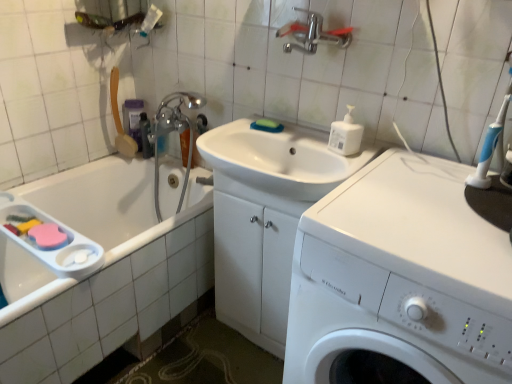
Question: Is green sponge at sink completely or partially inside blue plastic toothbrush at upper right?

Choices:
 (A) no
 (B) yes

Answer: (A)

Question: Can you confirm if blue plastic toothbrush at upper right is bigger than green sponge at sink?

Choices:
 (A) no
 (B) yes

Answer: (B)

Question: Does blue plastic toothbrush at upper right turn towards green sponge at sink?

Choices:
 (A) no
 (B) yes

Answer: (A)

Question: From a real-world perspective, is blue plastic toothbrush at upper right positioned over green sponge at sink based on gravity?

Choices:
 (A) no
 (B) yes

Answer: (B)

Question: Is the position of blue plastic toothbrush at upper right less distant than that of green sponge at sink?

Choices:
 (A) yes
 (B) no

Answer: (A)

Question: Is blue plastic toothbrush at upper right to the right of green sponge at sink from the viewer's perspective?

Choices:
 (A) no
 (B) yes

Answer: (B)

Question: Could you tell me if translucent plastic shampoo bottle at upper left, the second toiletry when ordered from right to left, is turned towards white glossy sink at center?

Choices:
 (A) no
 (B) yes

Answer: (A)

Question: Is white glossy sink at center at the back of translucent plastic shampoo bottle at upper left, the second toiletry when ordered from right to left?

Choices:
 (A) yes
 (B) no

Answer: (B)

Question: From a real-world perspective, is translucent plastic shampoo bottle at upper left, the first toiletry positioned from the left, below white glossy sink at center?

Choices:
 (A) no
 (B) yes

Answer: (B)

Question: Can you confirm if translucent plastic shampoo bottle at upper left, the second toiletry when ordered from right to left, is wider than white glossy sink at center?

Choices:
 (A) yes
 (B) no

Answer: (B)

Question: Is translucent plastic shampoo bottle at upper left, the first toiletry positioned from the left, smaller than white glossy sink at center?

Choices:
 (A) no
 (B) yes

Answer: (B)

Question: Can you confirm if translucent plastic shampoo bottle at upper left, the second toiletry when ordered from right to left, is positioned to the right of white glossy sink at center?

Choices:
 (A) no
 (B) yes

Answer: (A)

Question: Is green sponge at sink shorter than white plastic washing machine at center?

Choices:
 (A) yes
 (B) no

Answer: (A)